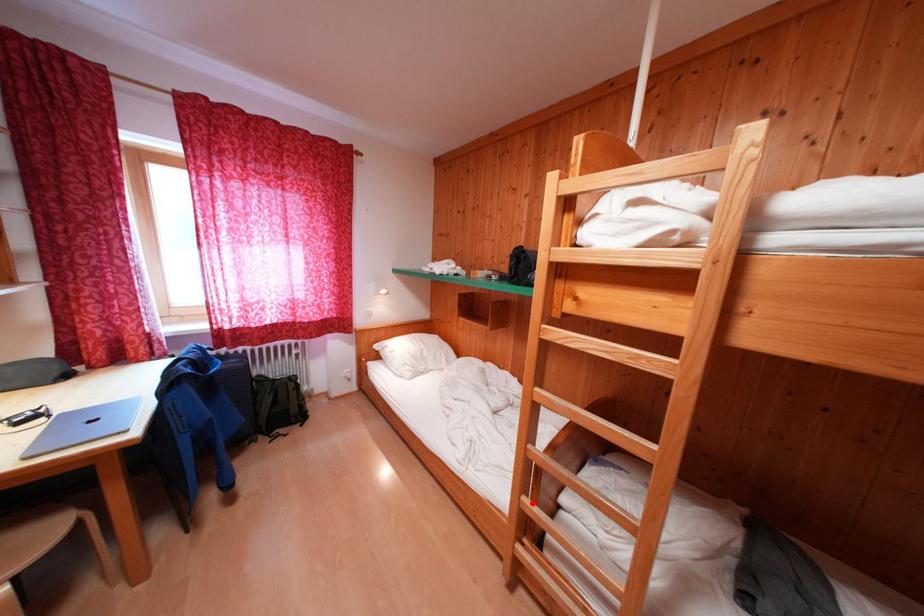
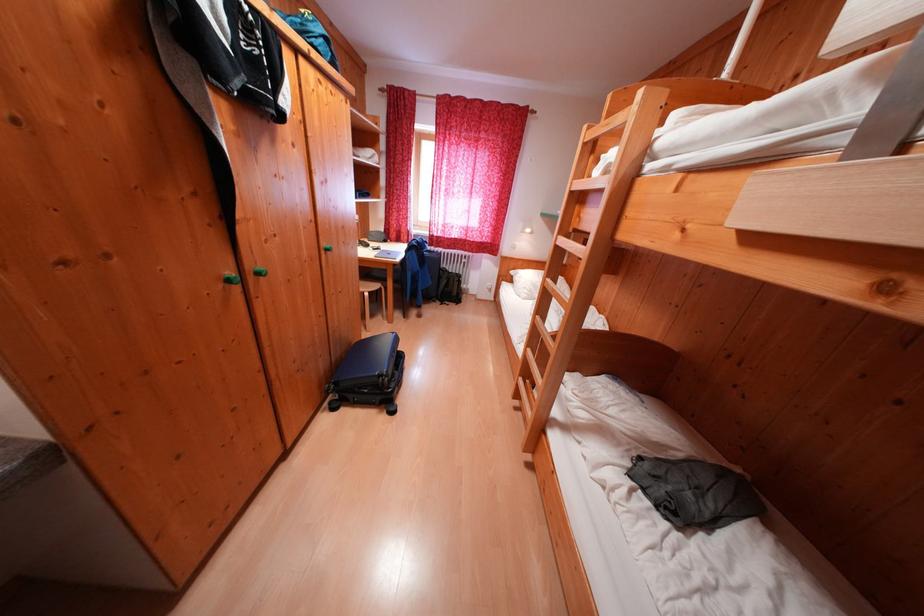
Question: I am providing you with two images of the same scene from different viewpoints. In image1, a red point is highlighted. Considering the same 3D point in image2, which of the following is correct?

Choices:
 (A) It is closer
 (B) It is farther

Answer: (A)